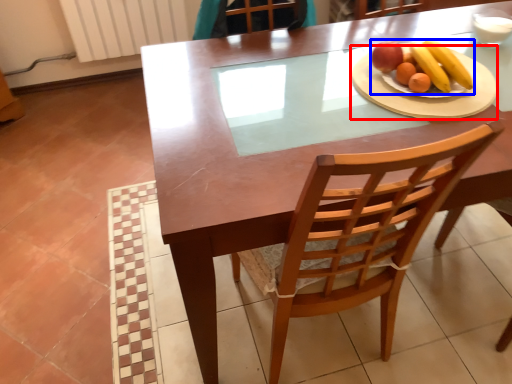
Question: Which point is further to the camera, platter (highlighted by a red box) or fruit dish (highlighted by a blue box)?

Choices:
 (A) platter
 (B) fruit dish

Answer: (B)